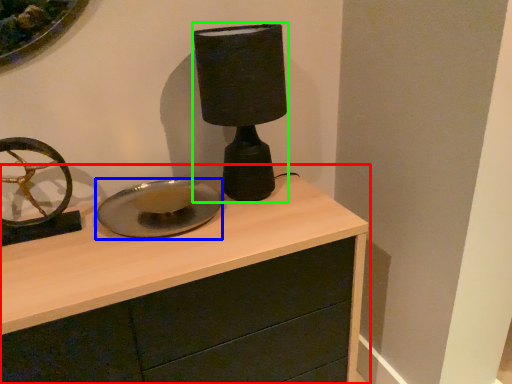
Question: Which object is positioned farthest from chest of drawers (highlighted by a red box)? Select from plate (highlighted by a blue box) and table lamp (highlighted by a green box).

Choices:
 (A) plate
 (B) table lamp

Answer: (B)